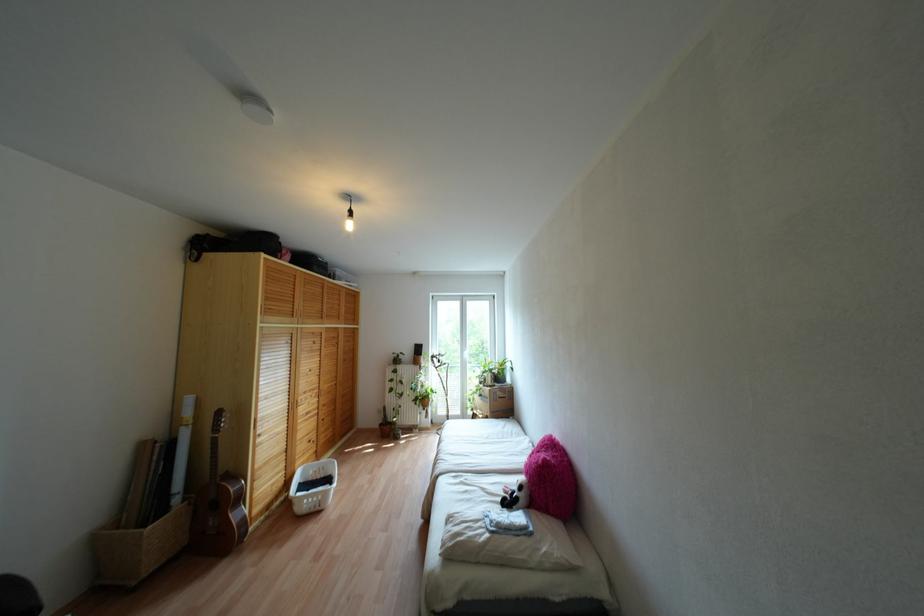
What do you see at coordinates (493, 400) in the screenshot?
I see `the cardboard box` at bounding box center [493, 400].